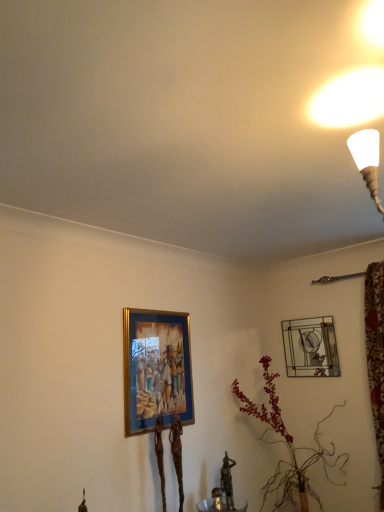
Question: Does leather-like plant at center-right touch metallic glass picture frame at upper right, acting as the second picture frame starting from the left?

Choices:
 (A) no
 (B) yes

Answer: (A)

Question: Can you confirm if leather-like plant at center-right is smaller than metallic glass picture frame at upper right, which is counted as the 1th picture frame, starting from the back?

Choices:
 (A) no
 (B) yes

Answer: (A)

Question: Is leather-like plant at center-right taller than metallic glass picture frame at upper right, the first picture frame positioned from the right?

Choices:
 (A) no
 (B) yes

Answer: (B)

Question: From the image's perspective, is leather-like plant at center-right beneath metallic glass picture frame at upper right, the 2th picture frame when ordered from front to back?

Choices:
 (A) yes
 (B) no

Answer: (A)

Question: Is leather-like plant at center-right at the right side of metallic glass picture frame at upper right, acting as the second picture frame starting from the left?

Choices:
 (A) yes
 (B) no

Answer: (B)

Question: From a real-world perspective, is leather-like plant at center-right positioned above or below gold-framed painting at lower left, which is the first picture frame in left-to-right order?

Choices:
 (A) above
 (B) below

Answer: (B)

Question: From the image's perspective, is leather-like plant at center-right located above or below gold-framed painting at lower left, the first picture frame from the front?

Choices:
 (A) below
 (B) above

Answer: (A)

Question: In terms of height, does leather-like plant at center-right look taller or shorter compared to gold-framed painting at lower left, which appears as the 2th picture frame when viewed from the back?

Choices:
 (A) short
 (B) tall

Answer: (B)

Question: Is leather-like plant at center-right to the left or to the right of gold-framed painting at lower left, the 2th picture frame in the right-to-left sequence, in the image?

Choices:
 (A) right
 (B) left

Answer: (A)

Question: Relative to leather-like plant at center-right, is gold-framed painting at lower left, which is the first picture frame in left-to-right order, in front or behind?

Choices:
 (A) behind
 (B) front

Answer: (B)

Question: From the image's perspective, is gold-framed painting at lower left, the first picture frame from the front, above or below leather-like plant at center-right?

Choices:
 (A) above
 (B) below

Answer: (A)

Question: In the image, is gold-framed painting at lower left, which is the first picture frame in left-to-right order, on the left side or the right side of leather-like plant at center-right?

Choices:
 (A) left
 (B) right

Answer: (A)

Question: Do you think gold-framed painting at lower left, the first picture frame from the front, is within leather-like plant at center-right, or outside of it?

Choices:
 (A) outside
 (B) inside

Answer: (A)

Question: In terms of height, does gold-framed painting at lower left, which is the first picture frame in left-to-right order, look taller or shorter compared to metallic glass picture frame at upper right, which is counted as the 1th picture frame, starting from the back?

Choices:
 (A) tall
 (B) short

Answer: (A)

Question: Relative to metallic glass picture frame at upper right, acting as the second picture frame starting from the left, is gold-framed painting at lower left, which appears as the 2th picture frame when viewed from the back, in front or behind?

Choices:
 (A) behind
 (B) front

Answer: (B)